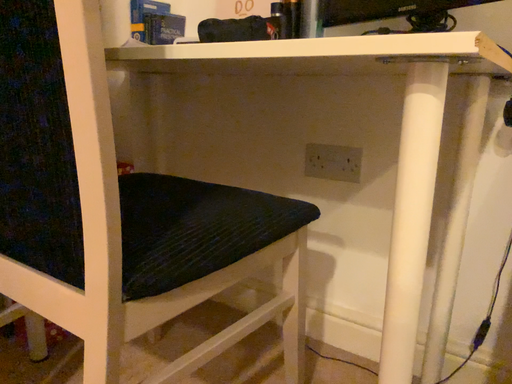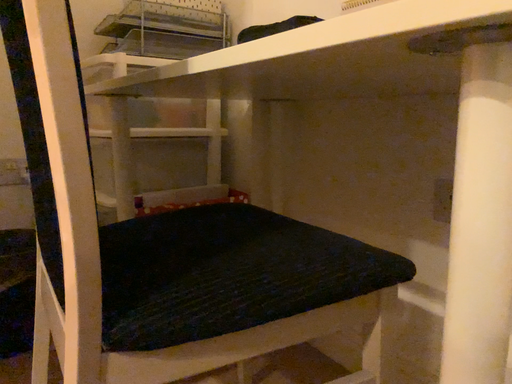
Question: Which way did the camera rotate in the video?

Choices:
 (A) rotated right
 (B) rotated left

Answer: (B)